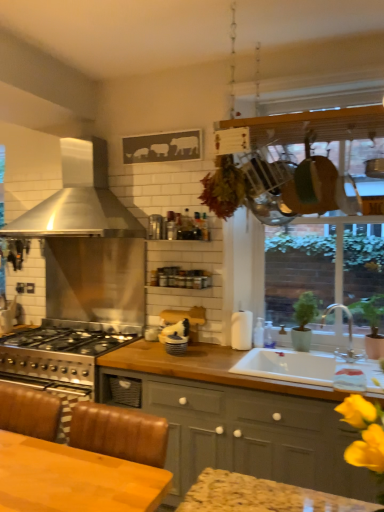
Locate an element on the screen. The width and height of the screenshot is (384, 512). vacant space situated on the left part of green matte plant at sink, the first plant viewed from the left is located at coordinates (286, 353).